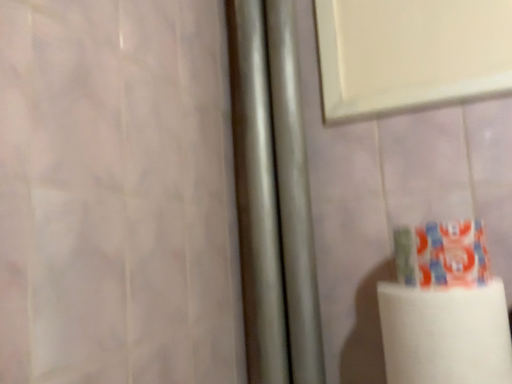
Question: Considering the relative sizes of multicolored plastic toothpaste at lower right and white matte paper towel at lower right in the image provided, is multicolored plastic toothpaste at lower right bigger than white matte paper towel at lower right?

Choices:
 (A) no
 (B) yes

Answer: (A)

Question: Is the position of multicolored plastic toothpaste at lower right more distant than that of white matte paper towel at lower right?

Choices:
 (A) yes
 (B) no

Answer: (A)

Question: From the image's perspective, is multicolored plastic toothpaste at lower right below white matte paper towel at lower right?

Choices:
 (A) no
 (B) yes

Answer: (A)

Question: Can you confirm if multicolored plastic toothpaste at lower right is positioned to the right of white matte paper towel at lower right?

Choices:
 (A) no
 (B) yes

Answer: (B)

Question: Can you confirm if multicolored plastic toothpaste at lower right is wider than white matte paper towel at lower right?

Choices:
 (A) yes
 (B) no

Answer: (B)

Question: Does multicolored plastic toothpaste at lower right turn towards white matte paper towel at lower right?

Choices:
 (A) no
 (B) yes

Answer: (A)

Question: Is white matte paper towel at lower right far away from multicolored plastic toothpaste at lower right?

Choices:
 (A) no
 (B) yes

Answer: (A)

Question: Considering the relative positions of white matte paper towel at lower right and multicolored plastic toothpaste at lower right in the image provided, is white matte paper towel at lower right to the right of multicolored plastic toothpaste at lower right from the viewer's perspective?

Choices:
 (A) no
 (B) yes

Answer: (A)

Question: Considering the relative sizes of white matte paper towel at lower right and multicolored plastic toothpaste at lower right in the image provided, is white matte paper towel at lower right wider than multicolored plastic toothpaste at lower right?

Choices:
 (A) no
 (B) yes

Answer: (B)

Question: Could you tell me if white matte paper towel at lower right is turned towards multicolored plastic toothpaste at lower right?

Choices:
 (A) no
 (B) yes

Answer: (A)

Question: Considering the relative sizes of white matte paper towel at lower right and multicolored plastic toothpaste at lower right in the image provided, is white matte paper towel at lower right shorter than multicolored plastic toothpaste at lower right?

Choices:
 (A) yes
 (B) no

Answer: (B)

Question: From the image's perspective, is white matte paper towel at lower right above multicolored plastic toothpaste at lower right?

Choices:
 (A) no
 (B) yes

Answer: (A)

Question: Is multicolored plastic toothpaste at lower right bigger or smaller than white matte paper towel at lower right?

Choices:
 (A) small
 (B) big

Answer: (A)